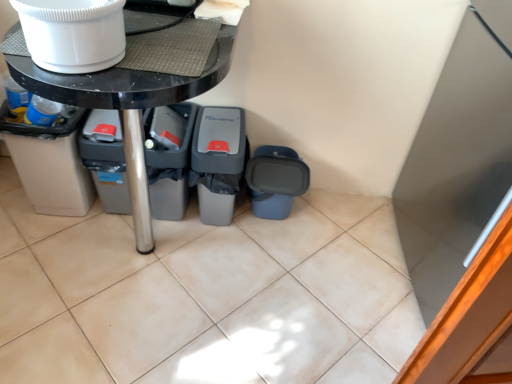
Where is `free spot in front of gray plastic recycling bin at center, which is counted as the third recycling bin, starting from the right`? Image resolution: width=512 pixels, height=384 pixels. free spot in front of gray plastic recycling bin at center, which is counted as the third recycling bin, starting from the right is located at coordinates (159, 243).